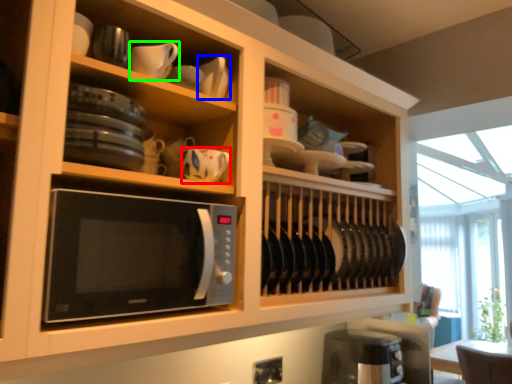
Question: Which object is positioned farthest from tableware (highlighted by a red box)? Select from tableware (highlighted by a blue box) and tableware (highlighted by a green box).

Choices:
 (A) tableware
 (B) tableware

Answer: (B)